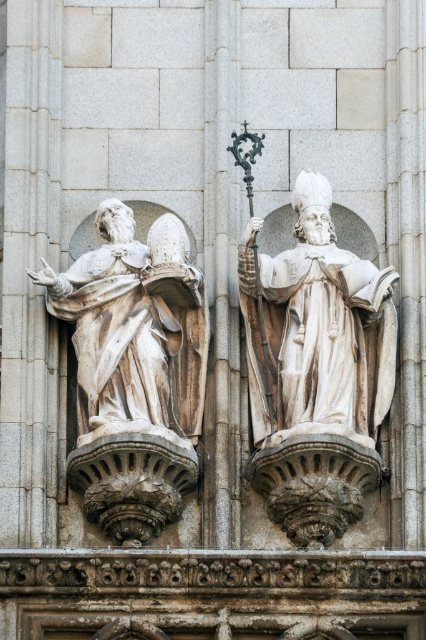
Does white marble statue at left have a larger size compared to smooth stone pillar at center?

Actually, white marble statue at left might be smaller than smooth stone pillar at center.

Which is in front, point (184, 460) or point (210, 440)?

Point (184, 460)

You are a GUI agent. You are given a task and a screenshot of the screen. Output one action in this format:
    pyautogui.click(x=<x>, y=<y>)
    Task: Click on the white marble statue at left
    The width and height of the screenshot is (426, 640).
    Given the screenshot: What is the action you would take?
    pyautogui.click(x=134, y=371)

Locate an element on the screen. Image resolution: width=426 pixels, height=640 pixels. white marble statue at left is located at coordinates (134, 371).